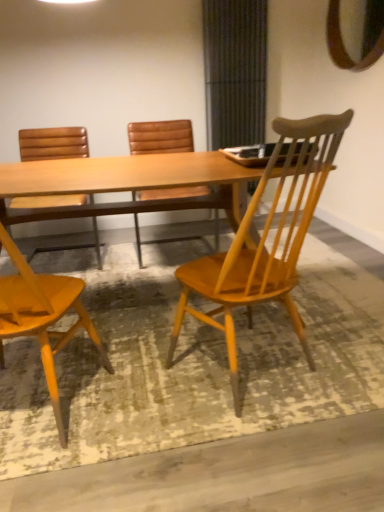
Where is `free location to the left of wooden chair at center, arranged as the 4th chair when viewed from the left`? The image size is (384, 512). free location to the left of wooden chair at center, arranged as the 4th chair when viewed from the left is located at coordinates (148, 408).